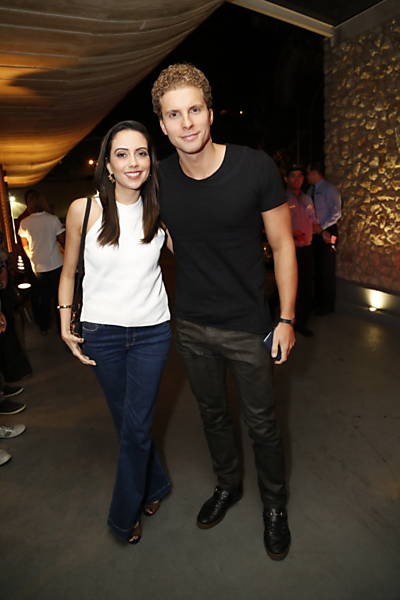
Find the location of `grey floor`. grey floor is located at coordinates (313, 572).